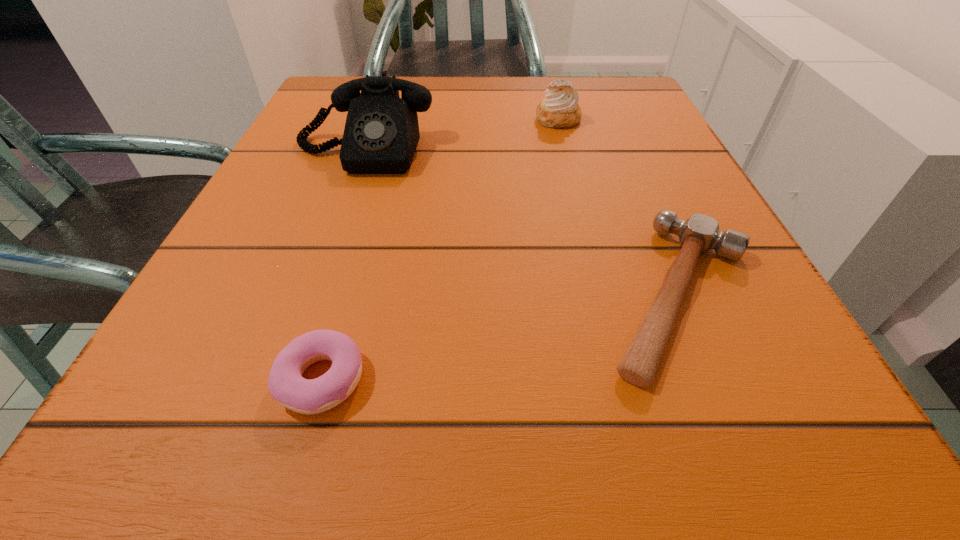
You are a GUI agent. You are given a task and a screenshot of the screen. Output one action in this format:
    pyautogui.click(x=<x>, y=<y>)
    Task: Click on the vacant space at the left edge
    The image size is (960, 540).
    Given the screenshot: What is the action you would take?
    pyautogui.click(x=257, y=371)

You are a GUI agent. You are given a task and a screenshot of the screen. Output one action in this format:
    pyautogui.click(x=<x>, y=<y>)
    Task: Click on the vacant area at the right edge of the desktop
    
    Given the screenshot: What is the action you would take?
    pyautogui.click(x=732, y=288)

At what (x,y) coordinates should I click in order to perform the action: click on vacant space at the far left corner of the desktop. Please return your answer as a coordinate pair (x, y). The image size is (960, 540). Looking at the image, I should click on (339, 83).

The height and width of the screenshot is (540, 960). I want to click on vacant space at the far right corner, so click(586, 98).

This screenshot has height=540, width=960. I want to click on free space between the left pastry and the farther pastry, so click(440, 249).

Locate an element on the screen. The width and height of the screenshot is (960, 540). free space between the farther pastry and the hammer is located at coordinates (619, 207).

Where is `empty location between the hammer and the right pastry`? The width and height of the screenshot is (960, 540). empty location between the hammer and the right pastry is located at coordinates (619, 207).

Identify the location of unoccupied position between the nearer pastry and the third shortest object. This screenshot has height=540, width=960. (440, 249).

In order to click on empty space between the second tallest object and the hammer in this screenshot , I will do `click(619, 207)`.

Locate an element on the screen. Image resolution: width=960 pixels, height=540 pixels. vacant area that lies between the second tallest object and the nearer pastry is located at coordinates (440, 249).